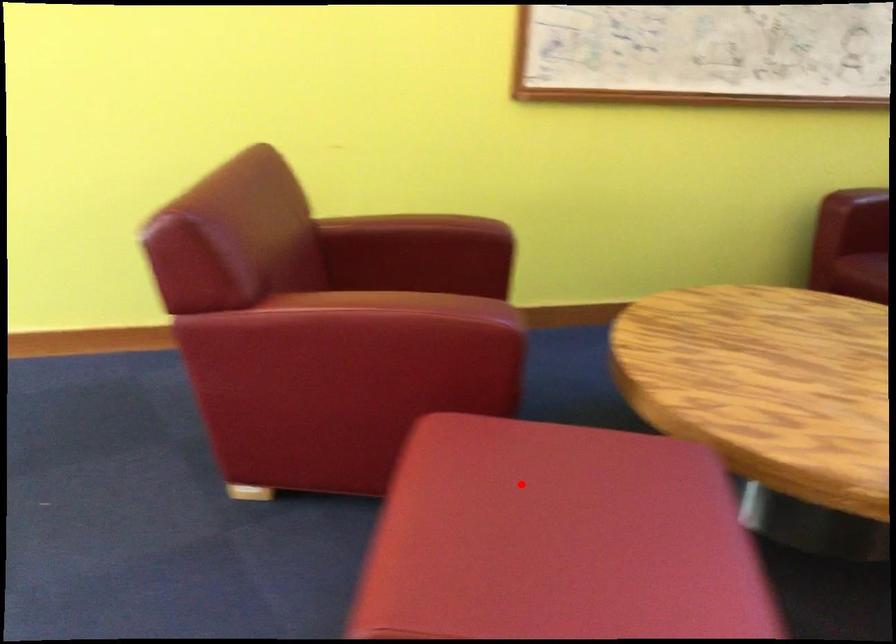
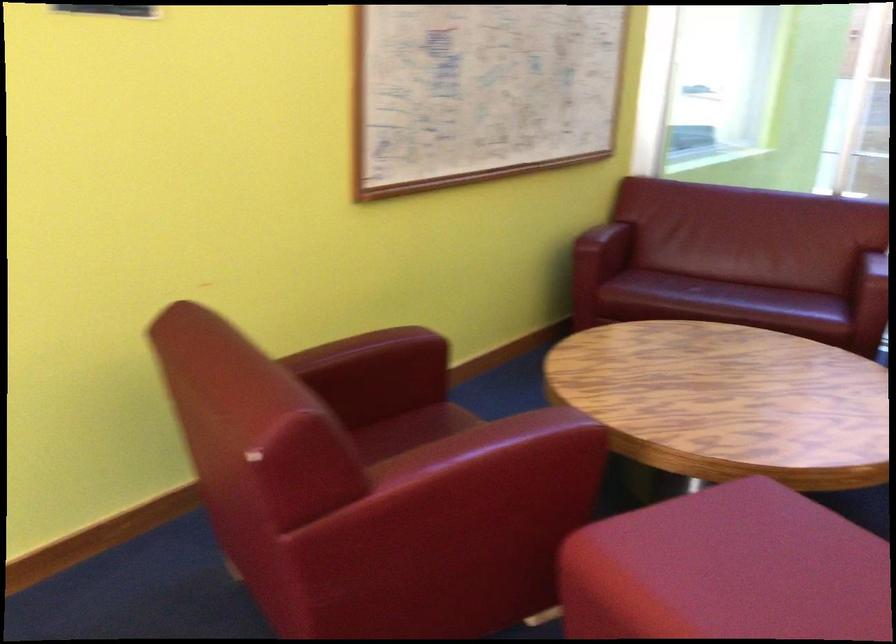
Locate, in the second image, the point that corresponds to the highlighted location in the first image.

(727, 570)